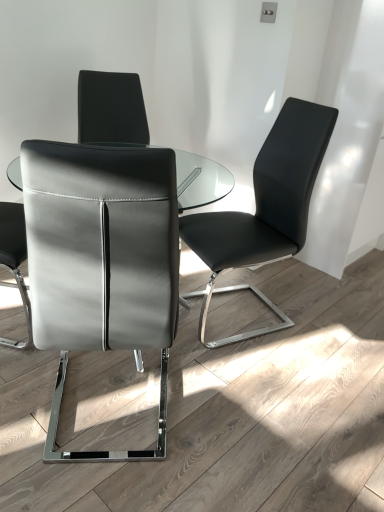
You are a GUI agent. You are given a task and a screenshot of the screen. Output one action in this format:
    pyautogui.click(x=<x>, y=<y>)
    Task: Click on the free spot to the right of black leather chair at center, placed as the first chair when sorted from right to left
    
    Given the screenshot: What is the action you would take?
    pyautogui.click(x=324, y=327)